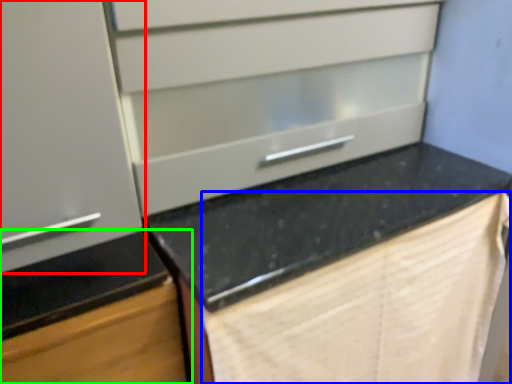
Question: Which object is the farthest from cabinetry (highlighted by a red box)? Choose among these: blanket (highlighted by a blue box) or cabinetry (highlighted by a green box).

Choices:
 (A) blanket
 (B) cabinetry

Answer: (A)